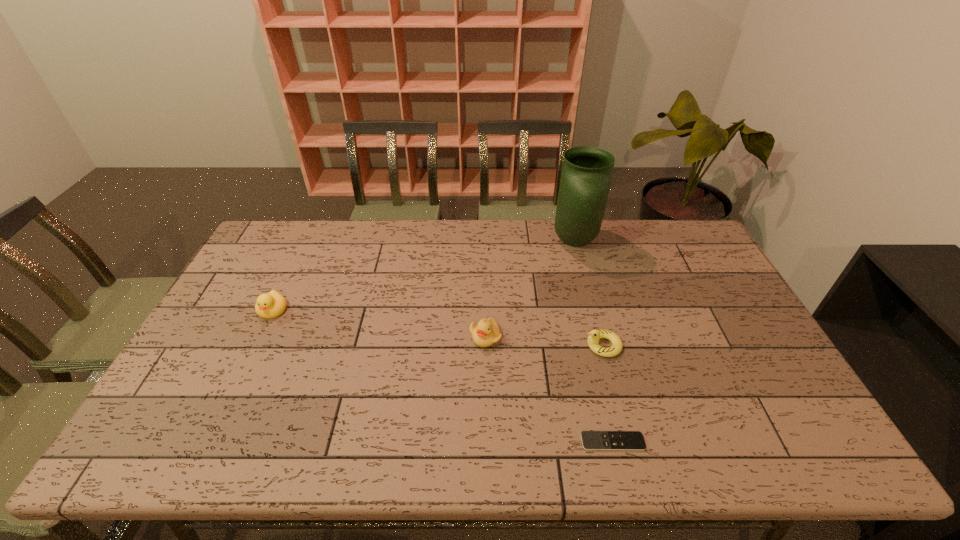
I want to click on vacant area in the image that satisfies the following two spatial constraints: 1. on the beak of the shortest object; 2. on the left side of the second object from left to right, so click(x=487, y=442).

Identify the location of vacant position in the image that satisfies the following two spatial constraints: 1. on the beak of the nearest object; 2. on the left side of the second duckling from left to right. (487, 442).